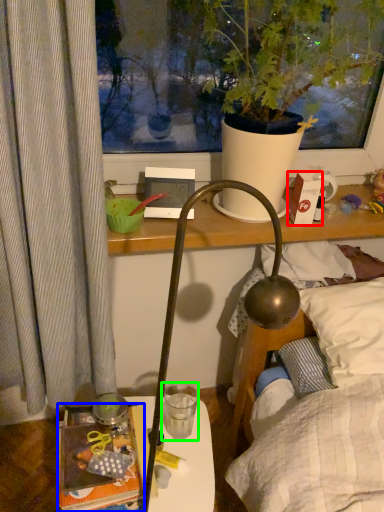
Question: Which object is positioned closest to box (highlighted by a red box)? Select from book (highlighted by a blue box) and coffee cup (highlighted by a green box).

Choices:
 (A) book
 (B) coffee cup

Answer: (B)